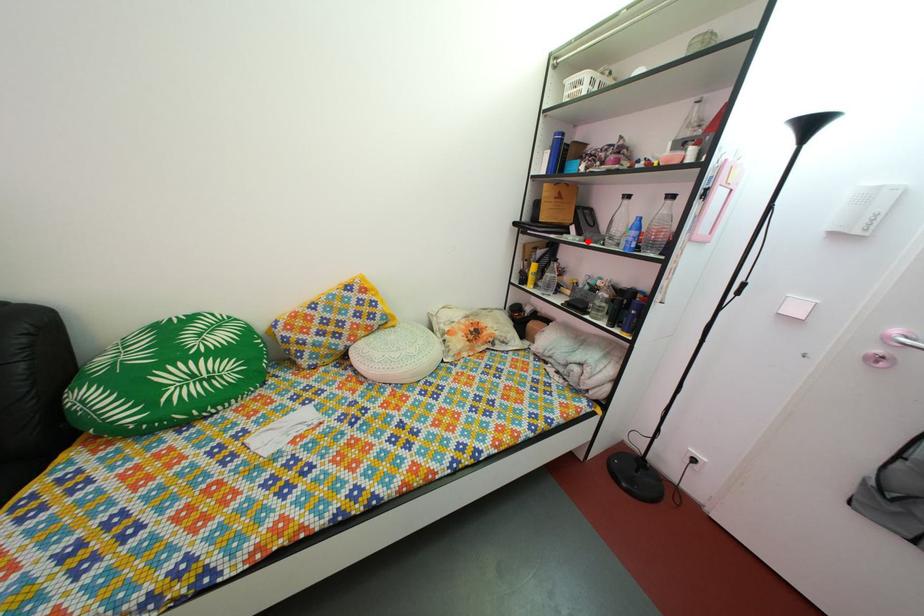
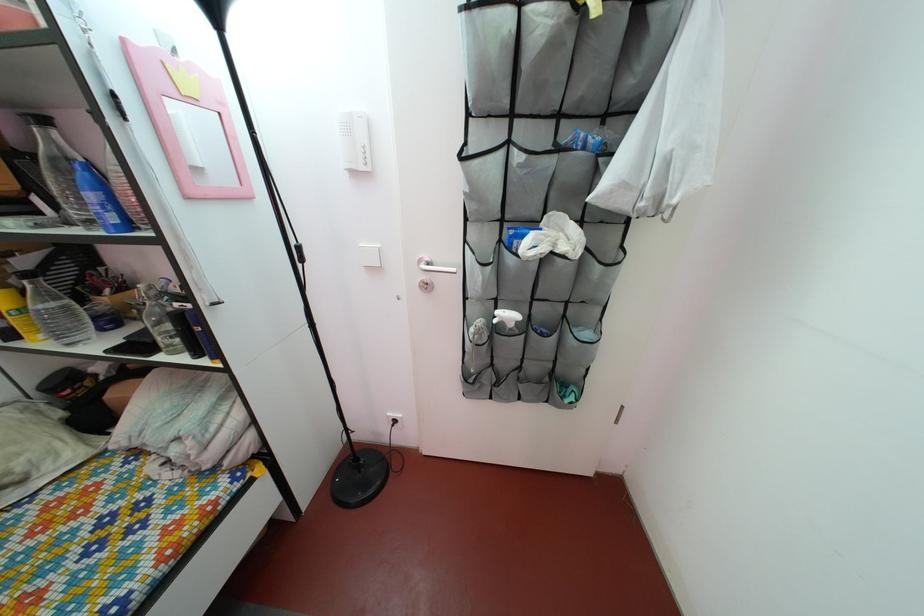
Question: I am providing you with two images of the same scene from different viewpoints. A red point is shown in image1. For the corresponding object point in image2, is it positioned nearer or farther from the camera?

Choices:
 (A) Nearer
 (B) Farther

Answer: (B)